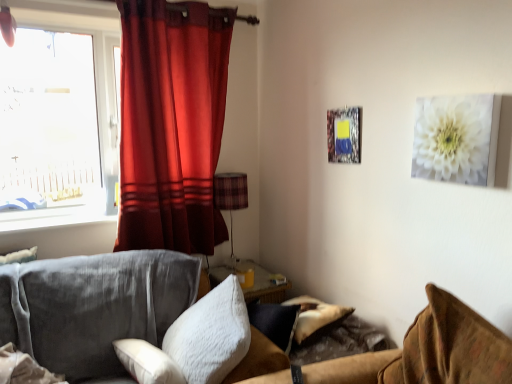
In order to face white soft pillow at center, the 2th pillow viewed from the right, should I rotate leftwards or rightwards?

Rotate your view left by about 15.964°.

Identify the location of satin red curtain at left. Image resolution: width=512 pixels, height=384 pixels. (170, 124).

Find the location of a particular element. white fluffy pillow at center, the second pillow viewed from the left is located at coordinates (210, 335).

This screenshot has height=384, width=512. I want to click on velvet brown couch at lower right, so click(x=421, y=353).

You are a GUI agent. You are given a task and a screenshot of the screen. Output one action in this format:
    pyautogui.click(x=<x>, y=<y>)
    Task: Click on the couch that appears on the left of white matte canvas at upper right
    The height and width of the screenshot is (384, 512).
    Given the screenshot: What is the action you would take?
    pyautogui.click(x=421, y=353)

Which object is thinner, white matte canvas at upper right or velvet brown couch at lower right?

white matte canvas at upper right.

Is white matte canvas at upper right placed right next to velvet brown couch at lower right?

white matte canvas at upper right and velvet brown couch at lower right are clearly separated.

Locate an element on the screen. couch lying in front of the transparent glass window at upper left is located at coordinates (421, 353).

Is transparent glass window at upper left oriented away from velvet brown couch at lower right?

No, transparent glass window at upper left is not facing the opposite direction of velvet brown couch at lower right.

Can you confirm if transparent glass window at upper left is positioned to the left of velvet brown couch at lower right?

Yes, transparent glass window at upper left is to the left of velvet brown couch at lower right.

Based on the photo, from a real-world perspective, is transparent glass window at upper left over velvet brown couch at lower right?

Yes.

Is transparent glass window at upper left to the left of satin red curtain at left from the viewer's perspective?

Indeed, transparent glass window at upper left is positioned on the left side of satin red curtain at left.

Is transparent glass window at upper left positioned beyond the bounds of satin red curtain at left?

transparent glass window at upper left lies outside satin red curtain at left's area.

Measure the distance from transparent glass window at upper left to satin red curtain at left.

transparent glass window at upper left is 16.87 inches from satin red curtain at left.

Who is smaller, transparent glass window at upper left or satin red curtain at left?

transparent glass window at upper left is smaller.

From the image's perspective, which object appears higher, white soft pillow at center, arranged as the 1th pillow when viewed from the left, or white glossy window sill at left?

white glossy window sill at left is shown above in the image.

Consider the image. Is white soft pillow at center, arranged as the 1th pillow when viewed from the left, placed right next to white glossy window sill at left?

No, white soft pillow at center, arranged as the 1th pillow when viewed from the left, is not in contact with white glossy window sill at left.

Can white glossy window sill at left be found inside white soft pillow at center, arranged as the 1th pillow when viewed from the left?

No, white glossy window sill at left is not inside white soft pillow at center, arranged as the 1th pillow when viewed from the left.

From the image's perspective, would you say plaid fabric lampshade at center is positioned over transparent glass window at upper left?

Incorrect, from the image's perspective, plaid fabric lampshade at center is lower than transparent glass window at upper left.

Where is `window in front of the plaid fabric lampshade at center`? window in front of the plaid fabric lampshade at center is located at coordinates (58, 119).

Considering the sizes of objects plaid fabric lampshade at center and transparent glass window at upper left in the image provided, who is smaller, plaid fabric lampshade at center or transparent glass window at upper left?

With smaller size is plaid fabric lampshade at center.

From a real-world perspective, who is located lower, transparent glass window at upper left or plaid fabric lampshade at center?

plaid fabric lampshade at center, from a real-world perspective.

Is transparent glass window at upper left not close to plaid fabric lampshade at center?

No, transparent glass window at upper left is not far from plaid fabric lampshade at center.

Considering the sizes of objects transparent glass window at upper left and plaid fabric lampshade at center in the image provided, who is bigger, transparent glass window at upper left or plaid fabric lampshade at center?

With larger size is transparent glass window at upper left.

Could you tell me if transparent glass window at upper left is turned towards plaid fabric lampshade at center?

No, transparent glass window at upper left is not facing towards plaid fabric lampshade at center.

The width and height of the screenshot is (512, 384). Identify the location of couch in front of the white glossy window sill at left. (421, 353).

Considering the relative sizes of velvet brown couch at lower right and white glossy window sill at left in the image provided, is velvet brown couch at lower right thinner than white glossy window sill at left?

In fact, velvet brown couch at lower right might be wider than white glossy window sill at left.

Is velvet brown couch at lower right positioned beyond the bounds of white glossy window sill at left?

Indeed, velvet brown couch at lower right is completely outside white glossy window sill at left.

Does velvet brown couch at lower right come in front of white glossy window sill at left?

Yes, velvet brown couch at lower right is in front of white glossy window sill at left.

What are the coordinates of `flower that is on the right side of velvet brown couch at lower right` in the screenshot? It's located at coord(453,139).

Locate an element on the screen. The image size is (512, 384). couch that appears below the transparent glass window at upper left (from a real-world perspective) is located at coordinates (421, 353).

Looking at the image, which one is located further to white fluffy pillow at center, which is the first pillow in right-to-left order, white matte canvas at upper right or transparent glass window at upper left?

transparent glass window at upper left is positioned further to the anchor white fluffy pillow at center, which is the first pillow in right-to-left order.

When comparing their distances from white glossy window sill at left, does white fluffy pillow at center, which is the first pillow in right-to-left order, or velvet brown couch at lower right seem further?

The object further to white glossy window sill at left is velvet brown couch at lower right.

Based on their spatial positions, is white soft pillow at center, the 2th pillow viewed from the right, or transparent glass window at upper left further from metallic silver picture frame at upper center?

transparent glass window at upper left is positioned further to the anchor metallic silver picture frame at upper center.

Looking at the image, which one is located closer to white soft pillow at center, the 2th pillow viewed from the right, white glossy window sill at left or satin red curtain at left?

Among the two, white glossy window sill at left is located nearer to white soft pillow at center, the 2th pillow viewed from the right.

From the image, which object appears to be farther from transparent glass window at upper left, white fluffy pillow at center, the second pillow viewed from the left, or metallic silver picture frame at upper center?

metallic silver picture frame at upper center.

When comparing their distances from transparent glass window at upper left, does white fluffy pillow at center, the second pillow viewed from the left, or plaid fabric lampshade at center seem closer?

Based on the image, plaid fabric lampshade at center appears to be nearer to transparent glass window at upper left.

Estimate the real-world distances between objects in this image. Which object is further from satin red curtain at left, white glossy window sill at left or metallic silver picture frame at upper center?

Among the two, metallic silver picture frame at upper center is located further to satin red curtain at left.

Estimate the real-world distances between objects in this image. Which object is further from metallic silver picture frame at upper center, plaid fabric lampshade at center or white fluffy pillow at center, the second pillow viewed from the left?

white fluffy pillow at center, the second pillow viewed from the left.

I want to click on window sill between white fluffy pillow at center, the second pillow viewed from the left, and plaid fabric lampshade at center, along the z-axis, so click(52, 218).

Where is `window located between white soft pillow at center, the 2th pillow viewed from the right, and plaid fabric lampshade at center in the depth direction`? window located between white soft pillow at center, the 2th pillow viewed from the right, and plaid fabric lampshade at center in the depth direction is located at coordinates (58, 119).

Locate an element on the screen. curtain between transparent glass window at upper left and white matte canvas at upper right is located at coordinates (170, 124).

The image size is (512, 384). In order to click on curtain between transparent glass window at upper left and metallic silver picture frame at upper center in the horizontal direction in this screenshot , I will do `click(170, 124)`.